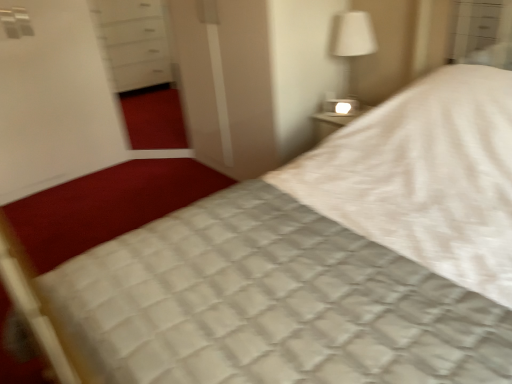
Question: From a real-world perspective, is transparent glass screen door at center, which is the first screen door in right-to-left order, positioned above or below white glossy screen door at upper left, the 1th screen door from the left?

Choices:
 (A) below
 (B) above

Answer: (A)

Question: Based on their sizes in the image, would you say transparent glass screen door at center, the 2th screen door from the left, is bigger or smaller than white glossy screen door at upper left, marked as the 2th screen door in a right-to-left arrangement?

Choices:
 (A) big
 (B) small

Answer: (B)

Question: Which object is positioned closest to the white fabric lampshade at upper right?

Choices:
 (A) white glossy screen door at upper left, the 1th screen door from the left
 (B) transparent glass screen door at center, which is the first screen door in right-to-left order

Answer: (B)

Question: Which object is positioned closest to the white glossy screen door at upper left, marked as the 2th screen door in a right-to-left arrangement?

Choices:
 (A) white fabric lampshade at upper right
 (B) transparent glass screen door at center, which is the first screen door in right-to-left order

Answer: (B)